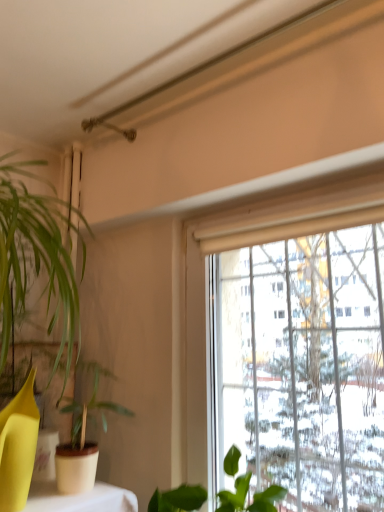
Question: Does green matte plant at left, the 1th houseplant positioned from the left, appear on the left side of green matte leafy plant at lower center, the first houseplant in the right-to-left sequence?

Choices:
 (A) no
 (B) yes

Answer: (B)

Question: From the image's perspective, is green matte plant at left, the 1th houseplant positioned from the left, on green matte leafy plant at lower center, the first houseplant in the right-to-left sequence?

Choices:
 (A) yes
 (B) no

Answer: (A)

Question: From the image's perspective, is green matte plant at left, the 1th houseplant positioned from the left, located beneath green matte leafy plant at lower center, the first houseplant in the right-to-left sequence?

Choices:
 (A) no
 (B) yes

Answer: (A)

Question: Is green matte plant at left, the second houseplant in the right-to-left sequence, positioned in front of green matte leafy plant at lower center, arranged as the 2th houseplant when viewed from the left?

Choices:
 (A) yes
 (B) no

Answer: (B)

Question: Is there a large distance between green matte plant at left, the second houseplant in the right-to-left sequence, and green matte leafy plant at lower center, arranged as the 2th houseplant when viewed from the left?

Choices:
 (A) no
 (B) yes

Answer: (A)

Question: Can we say green matte plant at left, the 1th houseplant positioned from the left, lies outside green matte leafy plant at lower center, the first houseplant in the right-to-left sequence?

Choices:
 (A) no
 (B) yes

Answer: (B)

Question: From a real-world perspective, is green matte leafy plant at lower center, arranged as the 2th houseplant when viewed from the left, positioned over green matte plant at left, the second houseplant in the right-to-left sequence, based on gravity?

Choices:
 (A) no
 (B) yes

Answer: (A)

Question: Does green matte leafy plant at lower center, the first houseplant in the right-to-left sequence, have a greater width compared to green matte plant at left, the 1th houseplant positioned from the left?

Choices:
 (A) no
 (B) yes

Answer: (B)

Question: Is green matte leafy plant at lower center, arranged as the 2th houseplant when viewed from the left, at the left side of green matte plant at left, the 1th houseplant positioned from the left?

Choices:
 (A) yes
 (B) no

Answer: (B)

Question: From a real-world perspective, is green matte leafy plant at lower center, the first houseplant in the right-to-left sequence, below green matte plant at left, the 1th houseplant positioned from the left?

Choices:
 (A) yes
 (B) no

Answer: (A)

Question: Considering the relative positions of green matte leafy plant at lower center, the first houseplant in the right-to-left sequence, and green matte plant at left, the second houseplant in the right-to-left sequence, in the image provided, is green matte leafy plant at lower center, the first houseplant in the right-to-left sequence, in front of green matte plant at left, the second houseplant in the right-to-left sequence,?

Choices:
 (A) yes
 (B) no

Answer: (A)

Question: Is green matte leafy plant at lower center, the first houseplant in the right-to-left sequence, far from green matte plant at left, the 1th houseplant positioned from the left?

Choices:
 (A) no
 (B) yes

Answer: (A)

Question: Based on their positions, is green matte plant at left, the 1th houseplant positioned from the left, located to the left or right of green matte leafy plant at lower center, arranged as the 2th houseplant when viewed from the left?

Choices:
 (A) right
 (B) left

Answer: (B)